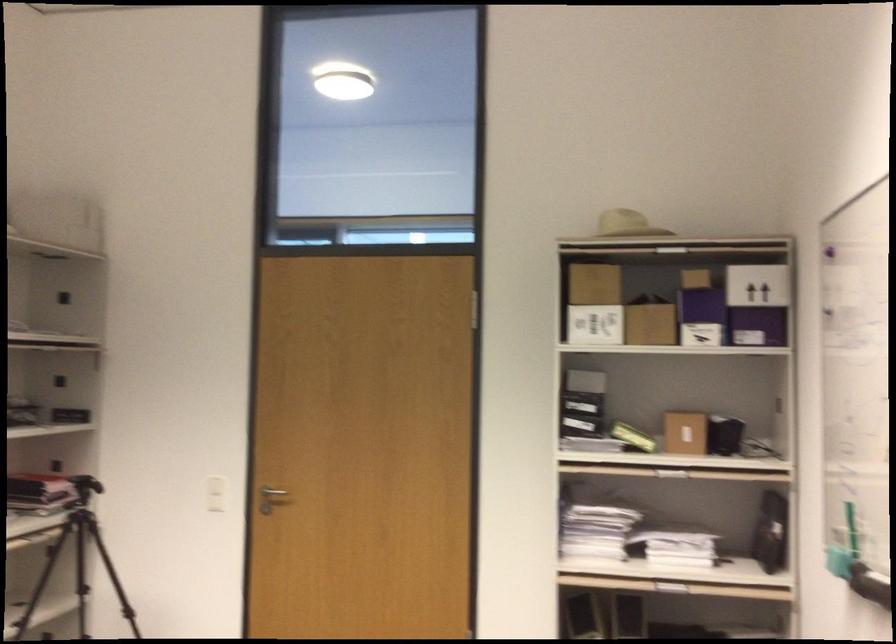
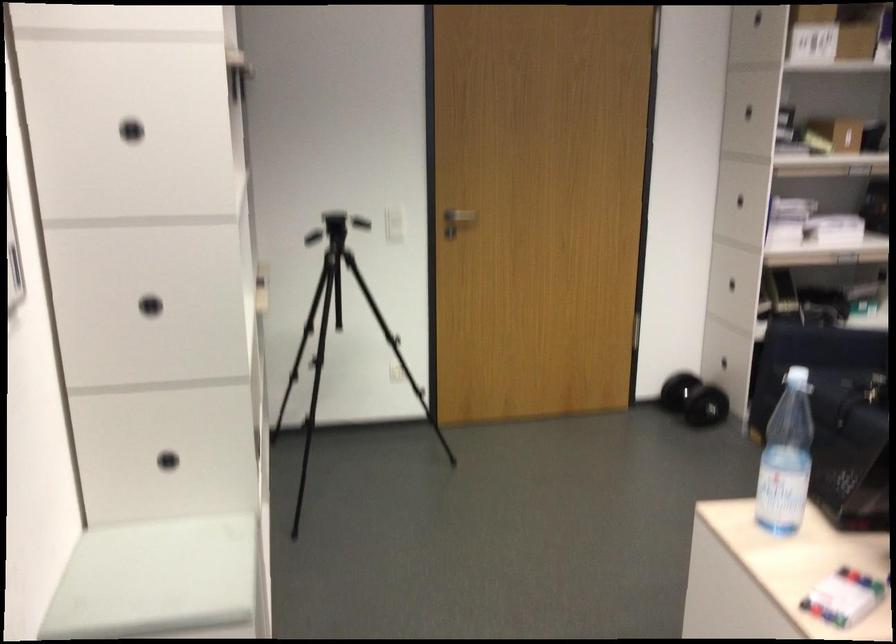
Where in the second image is the point corresponding to (244,485) from the first image?

(393, 214)